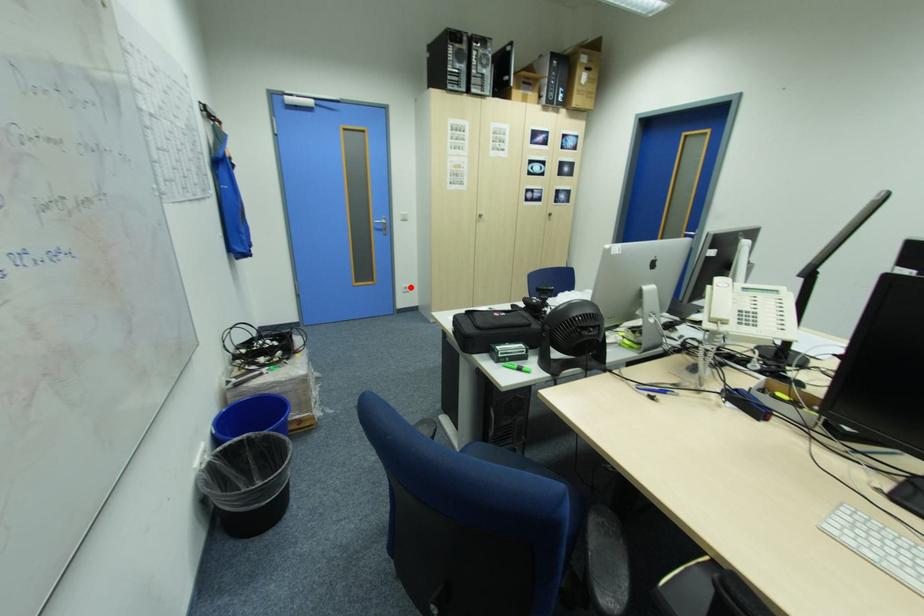
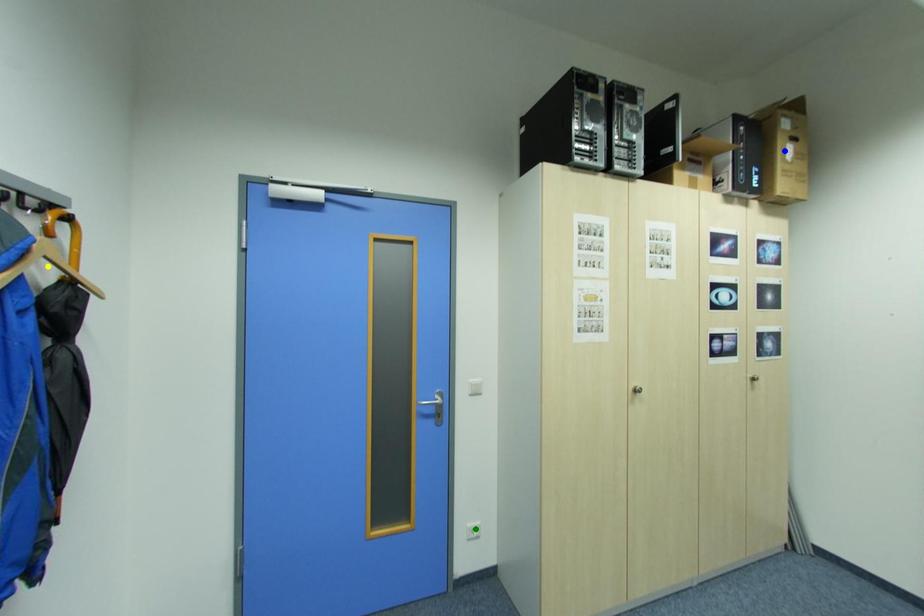
Question: I am providing you with two images of the same scene from different viewpoints. A red point is marked on the first image. You are given multiple points on the second image. Can you choose the point in image 2 that corresponds to the point in image 1?

Choices:
 (A) green point
 (B) blue point
 (C) yellow point

Answer: (A)